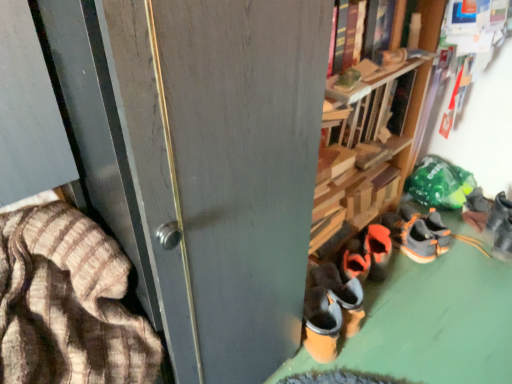
The width and height of the screenshot is (512, 384). In order to click on free location to the left of orange suede sneaker at lower right, which is the second footwear from right to left in this screenshot , I will do pyautogui.click(x=473, y=255).